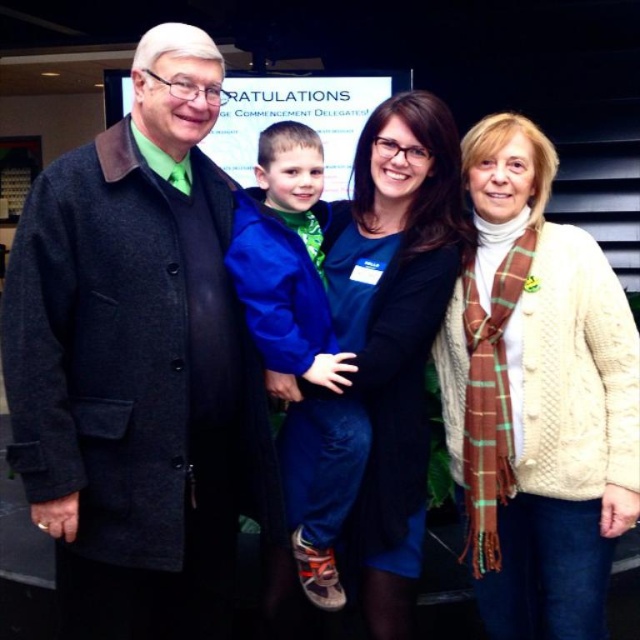
Consider the image. You are a photographer trying to capture a group photo of the matte black coat at left and the blue fleece jacket at center. The camera you are using has a minimum focus distance of 16 inches. Will you be able to focus on both subjects simultaneously?

The matte black coat at left and blue fleece jacket at center are 15.60 inches apart, which is less than the camera minimum focus distance of 16 inches. Therefore, the camera cannot focus on both subjects simultaneously.